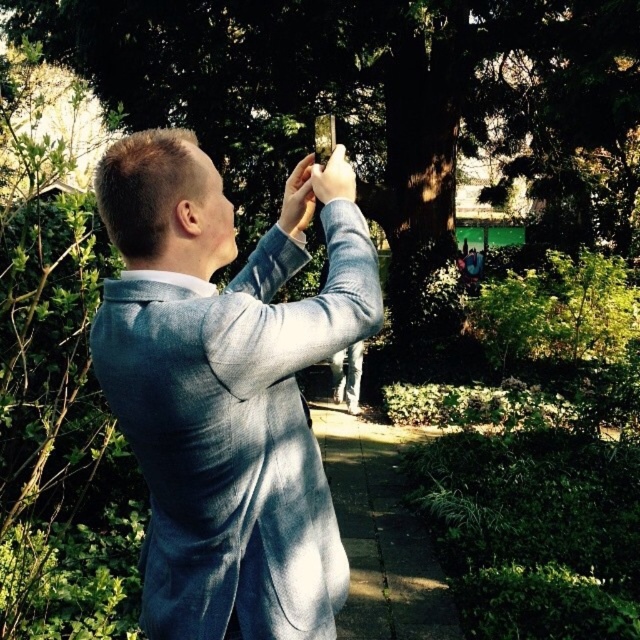
You are a photographer trying to capture a closeup shot of the matte gray phone at center. The matte blue hand at upper center is blocking part of the phone. Can you adjust your position to avoid the hand without moving the phone?

The matte blue hand at upper center is narrower than the matte gray phone at center, so yes, you can adjust your position to avoid the hand without moving the phone.

What is the exact coordinate of the matte blue hand at upper center?

The matte blue hand at upper center is located at point (298, 198).